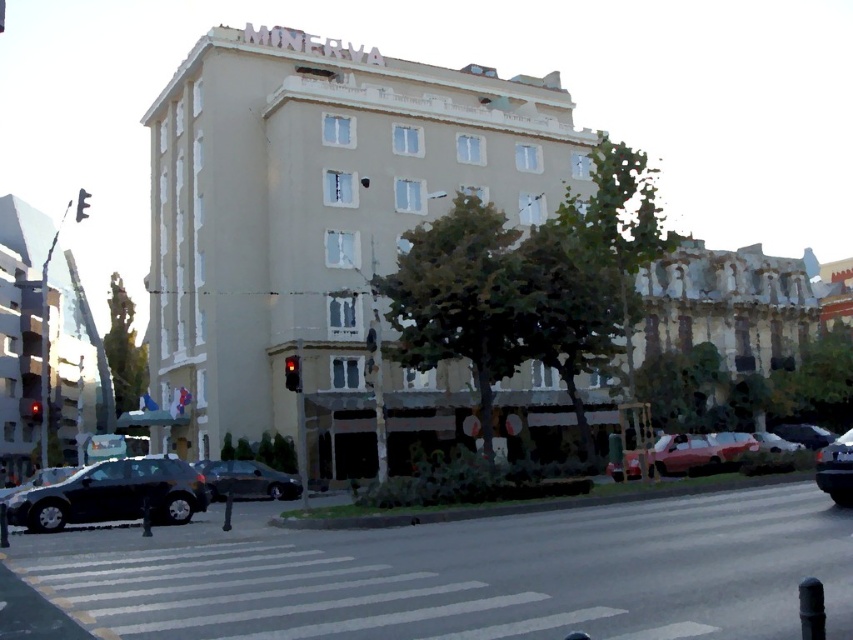
You are standing at the pedestrian crossing in front of the MINERVA building. There is a point marked at coordinates (317, 216). What does this point indicate?

The point marked at coordinates (317, 216) indicates the beige concrete building at center.

You are a delivery person standing on the sidewalk near the MINERVA building. You need to cross the street to deliver a package. The traffic light is red, so cars must stop. Can you safely cross the street while avoiding the shiny black car at lower right parked on the black asphalt road at lower center?

The black asphalt road at lower center might be wider than the shiny black car at lower right, so there could be enough space to cross safely if the car is parked and the traffic light is red. However, always check for moving vehicles before crossing.

You are a delivery person standing at the pedestrian crossing in front of the beige concrete building at center. You need to place a package in the shiny black car at lower right. Can you reach the car without crossing the street?

The beige concrete building at center and shiny black car at lower right are 25.94 meters apart. Since the car is on the same side of the street as you, you can reach it without crossing the street.